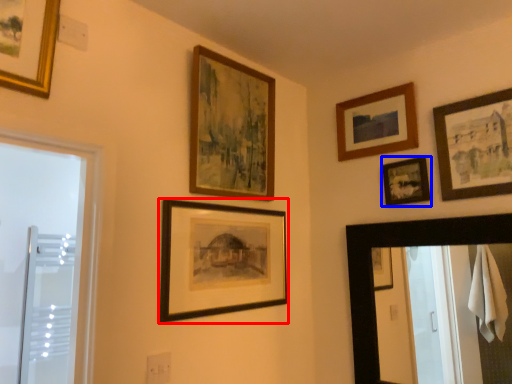
Question: Which object appears closest to the camera in this image, picture frame (highlighted by a red box) or picture frame (highlighted by a blue box)?

Choices:
 (A) picture frame
 (B) picture frame

Answer: (A)